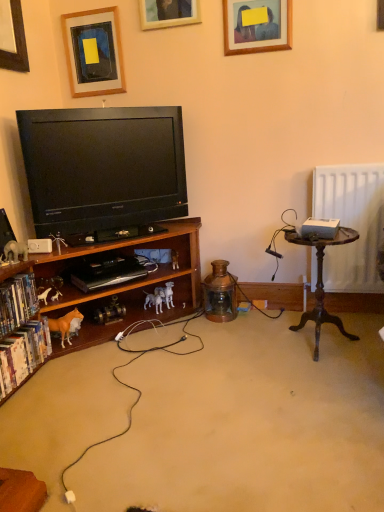
Locate an element on the screen. Image resolution: width=384 pixels, height=512 pixels. free point below wooden vintage table at right (from a real-world perspective) is located at coordinates (318, 347).